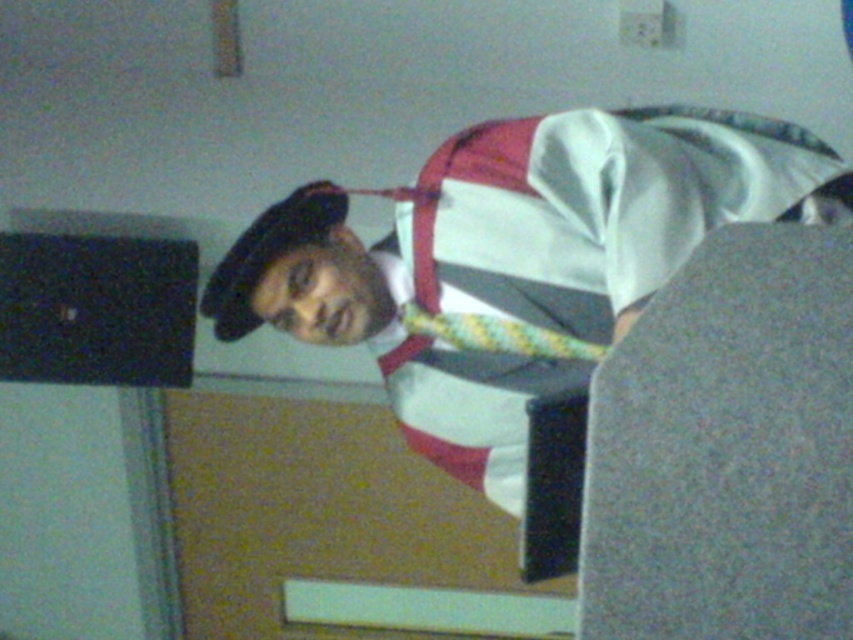
Is white satin hat at upper left closer to camera compared to yellow-green textured tie at center?

Yes, it is.

Can you confirm if white satin hat at upper left is positioned above yellow-green textured tie at center?

Correct, white satin hat at upper left is located above yellow-green textured tie at center.

Between point (660, 253) and point (459, 337), which one is positioned in front?

Point (660, 253)

At what (x,y) coordinates should I click in order to perform the action: click on white satin hat at upper left. Please return your answer as a coordinate pair (x, y). The image size is (853, 640). Looking at the image, I should click on (518, 257).